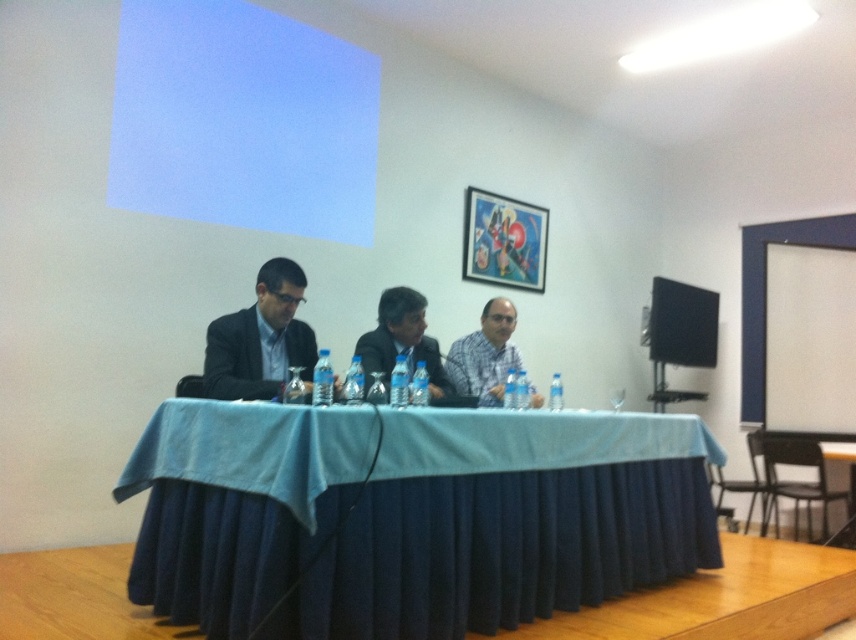
Question: Is blue fabric table at center positioned at the back of matte black suit at center?

Choices:
 (A) no
 (B) yes

Answer: (A)

Question: Among these points, which one is farthest from the camera?

Choices:
 (A) (663, 352)
 (B) (477, 403)

Answer: (A)

Question: In this image, where is black plastic speaker at right located relative to white shirt at center?

Choices:
 (A) above
 (B) below

Answer: (A)

Question: Is blue fabric table at center to the right of black plastic speaker at right from the viewer's perspective?

Choices:
 (A) no
 (B) yes

Answer: (A)

Question: Among these objects, which one is nearest to the camera?

Choices:
 (A) white glossy projection screen at upper center
 (B) white shirt at center
 (C) matte black suit at left
 (D) matte black suit at center

Answer: (C)

Question: Estimate the real-world distances between objects in this image. Which object is closer to the blue fabric table at center?

Choices:
 (A) black plastic speaker at right
 (B) white shirt at center
 (C) white glossy projection screen at upper center

Answer: (B)